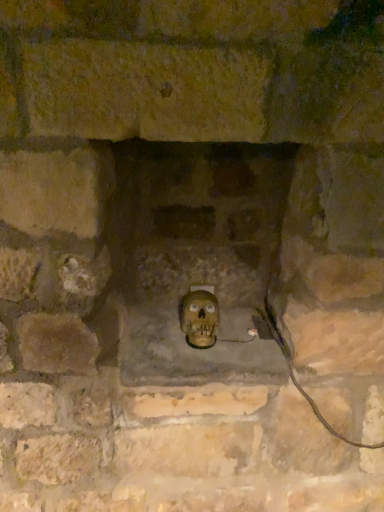
You are a GUI agent. You are given a task and a screenshot of the screen. Output one action in this format:
    pyautogui.click(x=<x>, y=<y>)
    Task: Click on the unoccupied area in front of matte brown skull at center
    This screenshot has width=384, height=512.
    Given the screenshot: What is the action you would take?
    pyautogui.click(x=205, y=364)